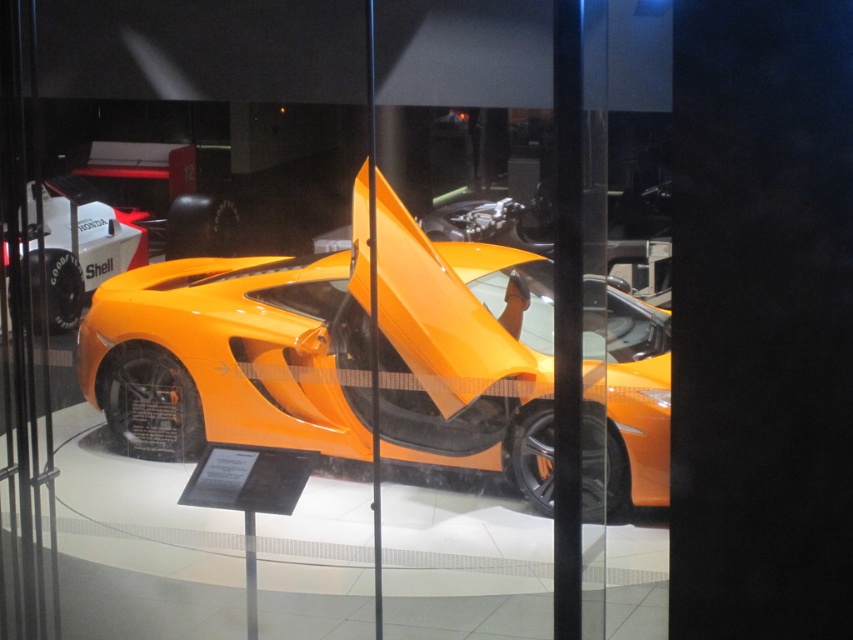
What do you see at coordinates (235, 352) in the screenshot?
I see `orange matte sports car at center` at bounding box center [235, 352].

Does orange matte sports car at center have a larger size compared to orange matte concept car at left?

Indeed, orange matte sports car at center has a larger size compared to orange matte concept car at left.

I want to click on orange matte sports car at center, so click(235, 352).

Where is `orange matte sports car at center`? Image resolution: width=853 pixels, height=640 pixels. orange matte sports car at center is located at coordinates pos(235,352).